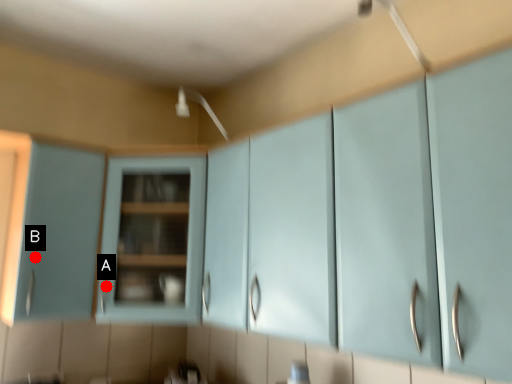
Question: Two points are circled on the image, labeled by A and B beside each circle. Which of the following is the closest to the observer?

Choices:
 (A) A is closer
 (B) B is closer

Answer: (B)